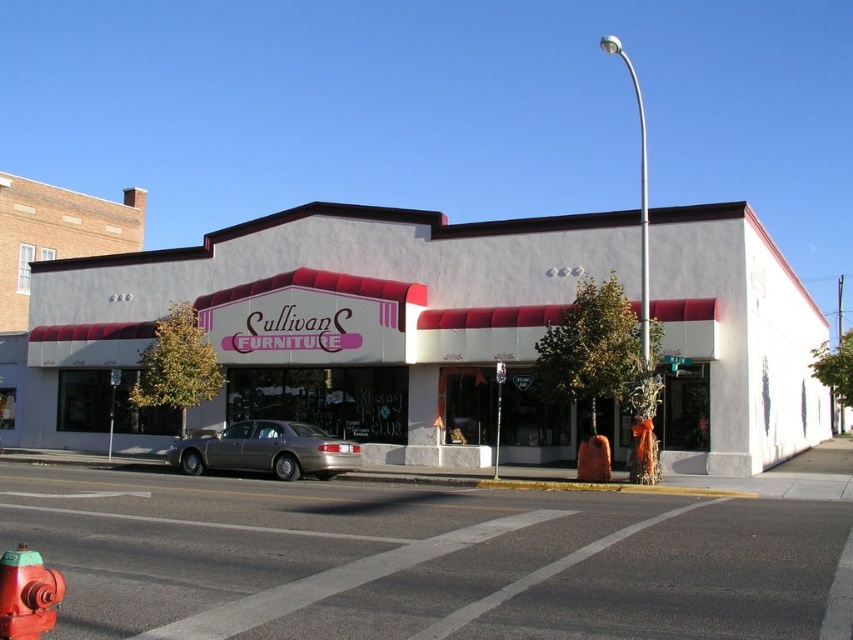
You are a delivery person who needs to unload a heavy box onto the smooth asphalt road at center. The box is too tall to fit through the door of your vehicle unless it is lying flat. However, you notice the red painted metal fire hydrant at lower left nearby. Considering their heights, will the box hit the fire hydrant if you tilt it upright while moving it across the road?

The smooth asphalt road at center has a greater height compared to the red painted metal fire hydrant at lower left. Since the road is higher, tilting the box upright while moving it across the road would mean the box is elevated above the hydrant, so it won

You are standing in front of Sullivan Furniture Store and want to take a photo that includes both the point at coordinates point (321, 348) and point (126, 612). Which point should be closer to the camera in your photo?

Point (321, 348) is further to the camera than point (126, 612), so point (126, 612) will be closer to the camera in your photo.

You are standing at the entrance of Sullivan Furniture and want to walk to the point marked by point (766, 634) and point (3, 621). Which point should you walk towards first to reach both points in the correct order?

You should walk towards point (3, 621) first because point (766, 634) is behind it, so you need to pass point (3, 621) before reaching the other point.